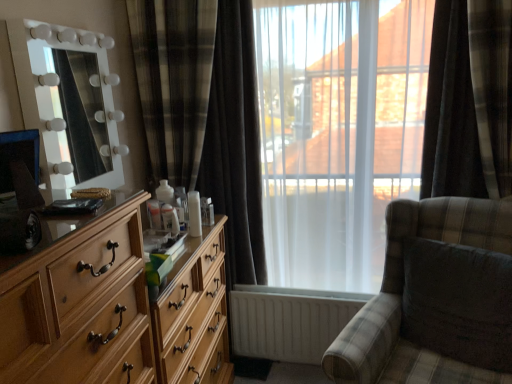
Question: In the image, is plaid fabric swivel chair at right on the left side or the right side of plaid fabric rocking chair at center?

Choices:
 (A) right
 (B) left

Answer: (A)

Question: From the image's perspective, is plaid fabric swivel chair at right above or below plaid fabric rocking chair at center?

Choices:
 (A) above
 (B) below

Answer: (A)

Question: Based on their relative distances, which object is nearer to the white glossy mirror at left?

Choices:
 (A) plaid fabric rocking chair at center
 (B) plaid fabric curtain at center, positioned as the first curtain in left-to-right order
 (C) plaid fabric swivel chair at right
 (D) white sheer curtains at center
 (E) light wood dresser at left

Answer: (B)

Question: Which object is the farthest from the plaid fabric curtain at center, positioned as the first curtain in left-to-right order?

Choices:
 (A) white sheer curtains at center
 (B) light wood dresser at left
 (C) white plastic radiator at lower center
 (D) plaid fabric swivel chair at right
 (E) dark plaid curtain at right, which ranks as the 2th curtain in left-to-right order

Answer: (D)